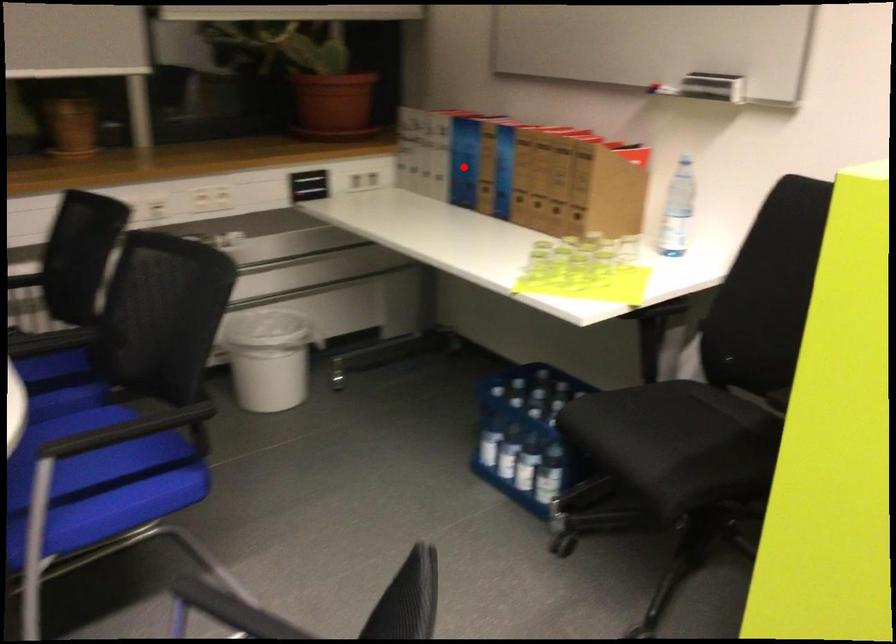
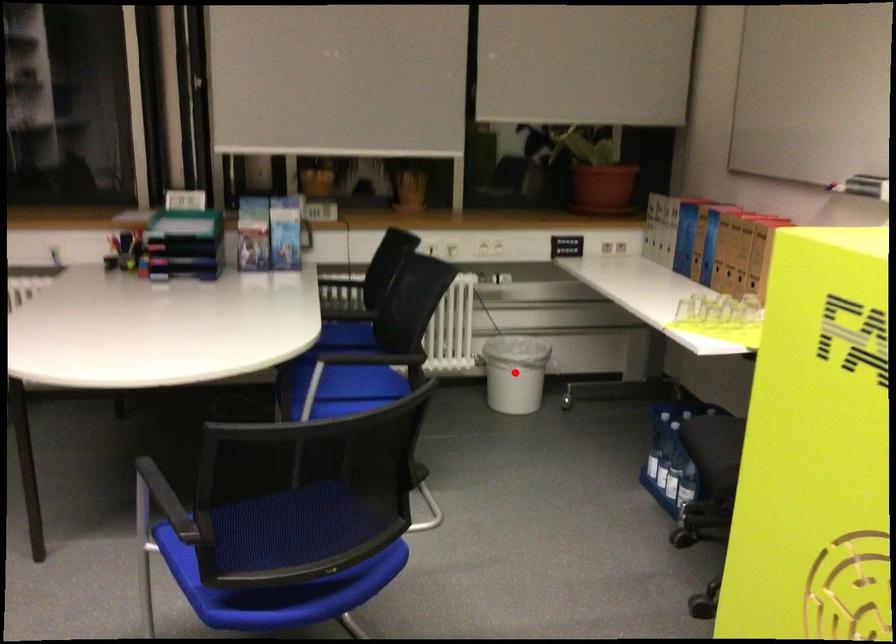
I am providing you with two images of the same scene from different viewpoints. A red point is marked on the first image and another point is marked on the second image. Are the points marked in image1 and image2 representing the same 3D position?

No